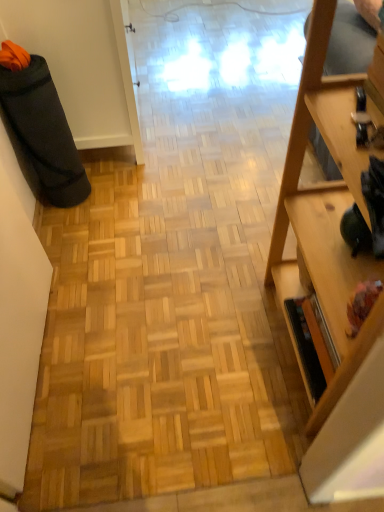
What is the approximate width of black fabric bag at left?

It is 8.07 inches.

Image resolution: width=384 pixels, height=512 pixels. Identify the location of black fabric bag at left. click(x=43, y=134).

Describe the element at coordinates (43, 134) in the screenshot. The image size is (384, 512). I see `black fabric bag at left` at that location.

Locate an element on the screen. black fabric bag at left is located at coordinates (43, 134).